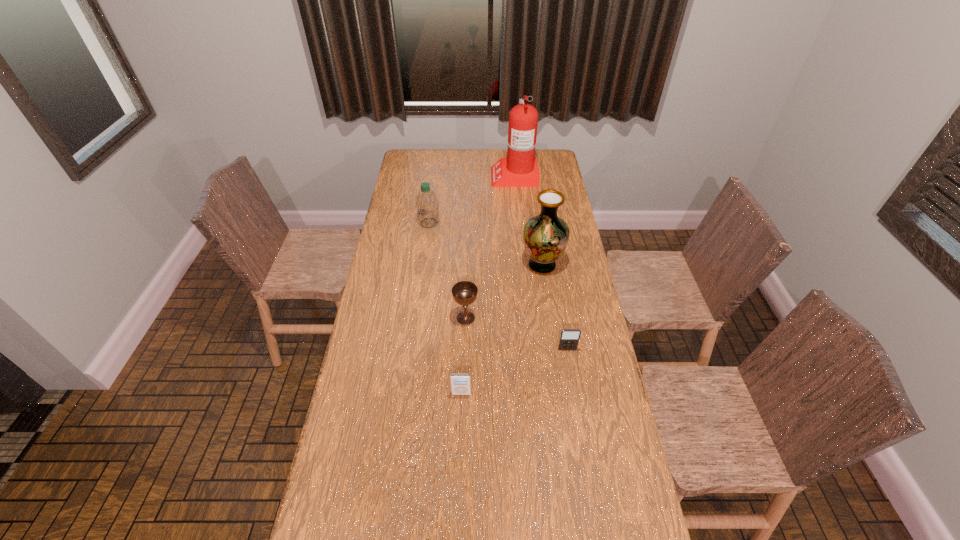
Image resolution: width=960 pixels, height=540 pixels. In order to click on object that stands as the closest to the second farthest object in this screenshot , I will do `click(520, 169)`.

Identify the location of free space that satisfies the following two spatial constraints: 1. on the front-facing side of the tallest object; 2. on the right side of the fifth shortest object. (523, 265).

Where is `blank space that satisfies the following two spatial constraints: 1. on the front-facing side of the fire extinguisher; 2. on the back side of the fourth nearest object`? This screenshot has height=540, width=960. blank space that satisfies the following two spatial constraints: 1. on the front-facing side of the fire extinguisher; 2. on the back side of the fourth nearest object is located at coordinates tap(523, 265).